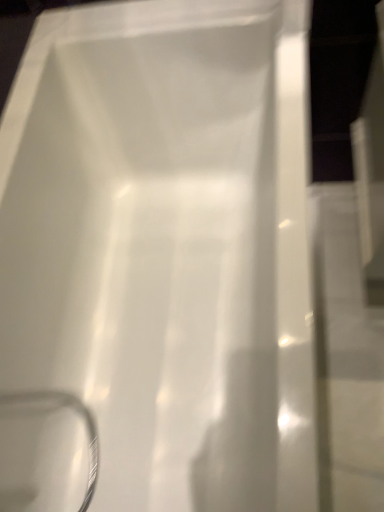
You are a GUI agent. You are given a task and a screenshot of the screen. Output one action in this format:
    pyautogui.click(x=<x>, y=<y>)
    Task: Click on the clear plastic magnifying glass at lower left
    This screenshot has width=384, height=512.
    Given the screenshot: What is the action you would take?
    coord(46,452)

Describe the element at coordinates (46, 452) in the screenshot. I see `clear plastic magnifying glass at lower left` at that location.

Where is `clear plastic magnifying glass at lower left`? The height and width of the screenshot is (512, 384). clear plastic magnifying glass at lower left is located at coordinates (46, 452).